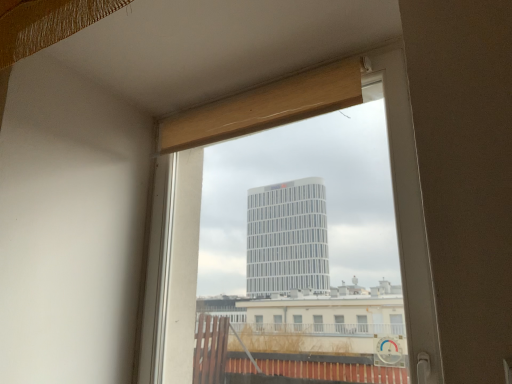
The image size is (512, 384). What do you see at coordinates (172, 266) in the screenshot?
I see `transparent glass window at center` at bounding box center [172, 266].

Find the location of `transparent glass window at center`. transparent glass window at center is located at coordinates click(172, 266).

What is the approximate height of transparent glass window at center?

1.11 meters.

What is the approximate width of transparent glass window at center?

transparent glass window at center is 5.47 inches in width.

At what (x,y) coordinates should I click in order to perform the action: click on transparent glass window at center. Please return your answer as a coordinate pair (x, y). The image size is (512, 384). Looking at the image, I should click on 172,266.